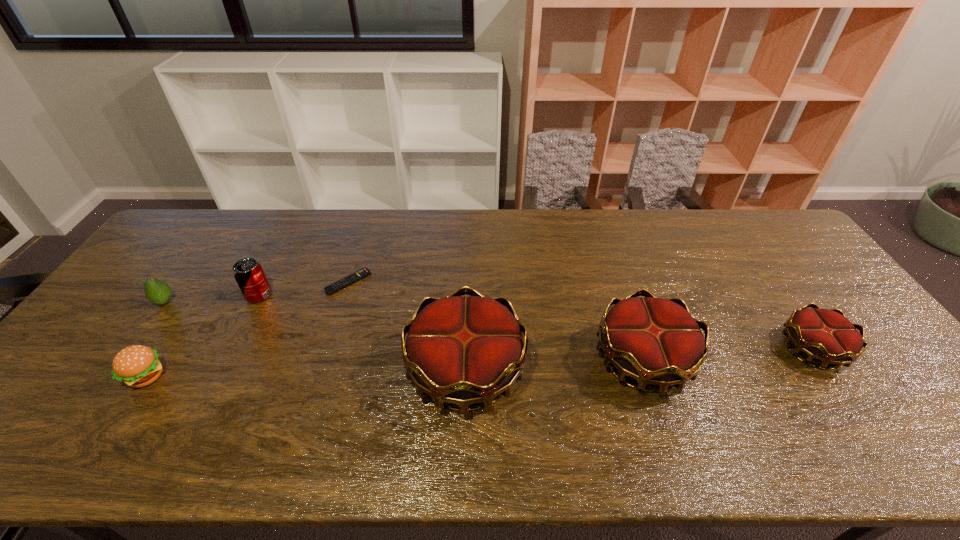
This screenshot has width=960, height=540. Identify the location of object that is positioned at the right edge. (825, 335).

Find the location of a particular element. free space at the far edge is located at coordinates (548, 228).

In the image, there is a desktop. Where is `vacant area at the near edge`? Image resolution: width=960 pixels, height=540 pixels. vacant area at the near edge is located at coordinates (245, 390).

The height and width of the screenshot is (540, 960). In the image, there is a desktop. Identify the location of blank space at the right edge. (844, 307).

Where is `vacant space at the far right corner of the desktop`? The width and height of the screenshot is (960, 540). vacant space at the far right corner of the desktop is located at coordinates (790, 246).

Find the location of a particular element. The image size is (960, 540). free spot between the rightmost crown and the remote control is located at coordinates (581, 315).

Identify the location of vacant area between the second crown from right to left and the hamburger. This screenshot has width=960, height=540. (395, 368).

Locate an element on the screen. This screenshot has width=960, height=540. free space between the fifth object from left to right and the sixth object from left to right is located at coordinates click(x=554, y=365).

Where is `the third closest object to the soda can`? The width and height of the screenshot is (960, 540). the third closest object to the soda can is located at coordinates (137, 366).

Select which object is the fourth closest to the second shortest crown. Please provide its 2D coordinates. Your answer should be formatted as a tuple, i.e. [(x, y)], where the tuple contains the x and y coordinates of a point satisfying the conditions above.

[(248, 273)]